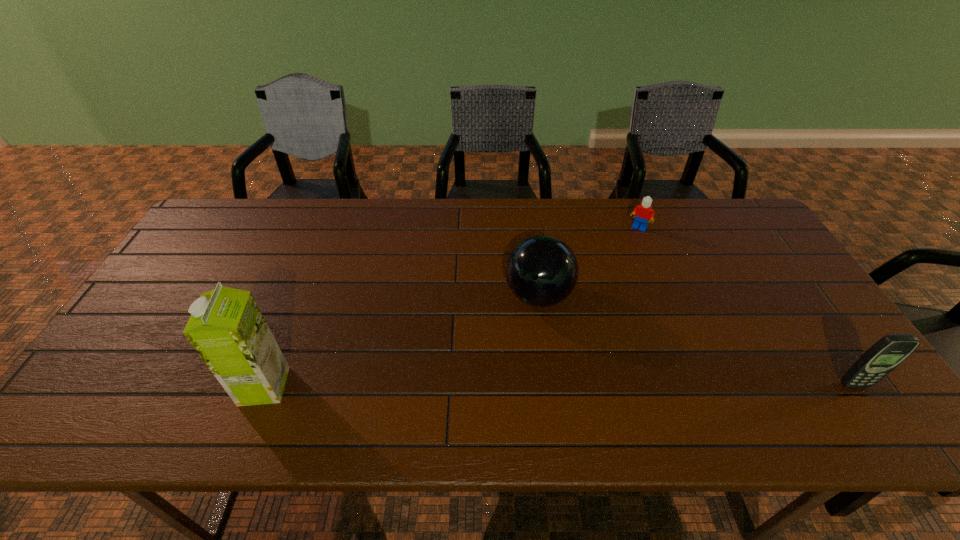
This screenshot has height=540, width=960. I want to click on free space on the desktop that is between the leftmost object and the rightmost object and is positioned on the face of the shortest object, so click(x=541, y=386).

Where is `vacant spot on the desktop that is between the soya milk and the rightmost object and is positioned on the side of the third nearest object with the finger holes`? The image size is (960, 540). vacant spot on the desktop that is between the soya milk and the rightmost object and is positioned on the side of the third nearest object with the finger holes is located at coordinates (x=498, y=386).